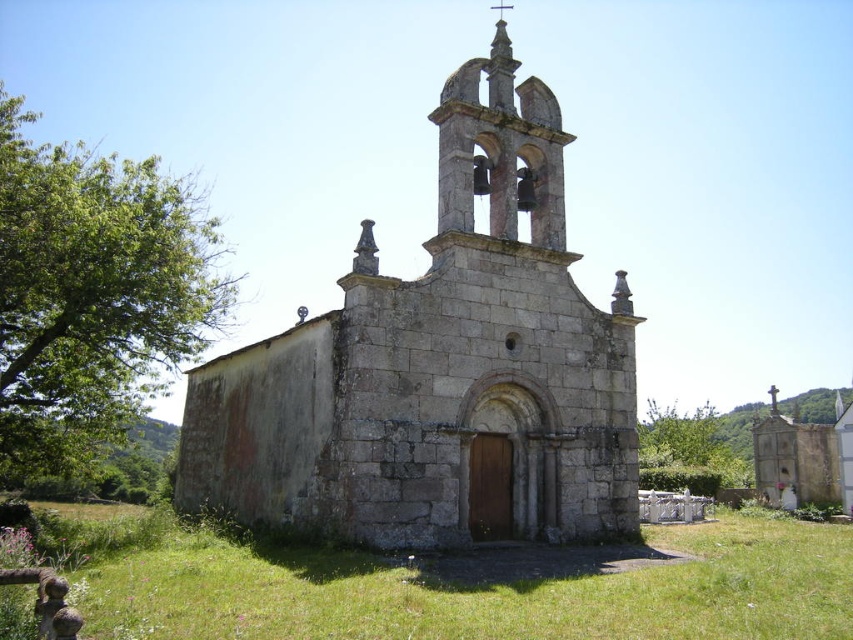
Is point (619, 429) closer to viewer compared to point (444, 577)?

No.

Can you confirm if stone church at center is positioned to the right of green grass at lower center?

Incorrect, stone church at center is not on the right side of green grass at lower center.

Looking at this image, who is more distant from viewer, (368,483) or (175,611)?

The point (368,483) is more distant.

Locate an element on the screen. stone church at center is located at coordinates (439, 368).